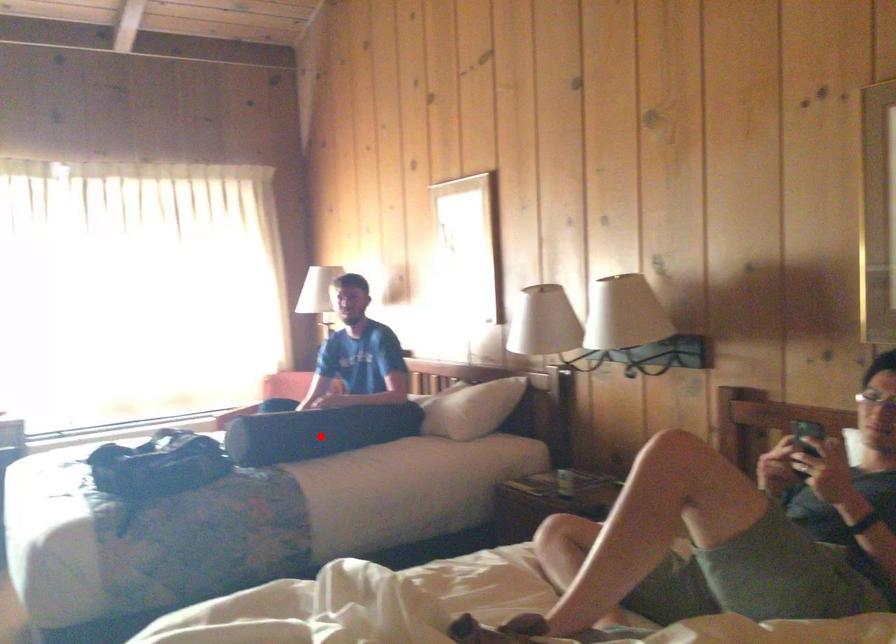
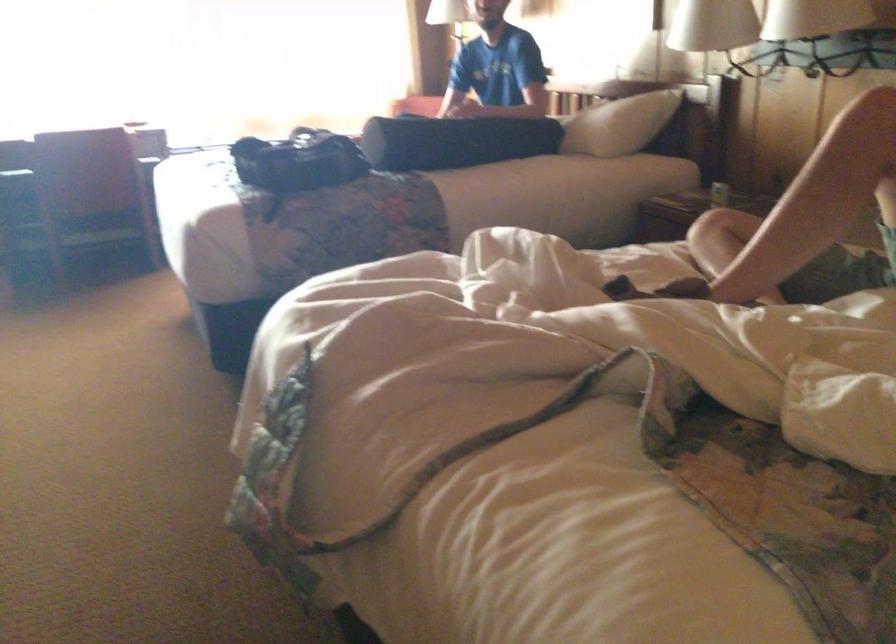
Find the pixel in the second image that matches the highlighted location in the first image.

(454, 140)